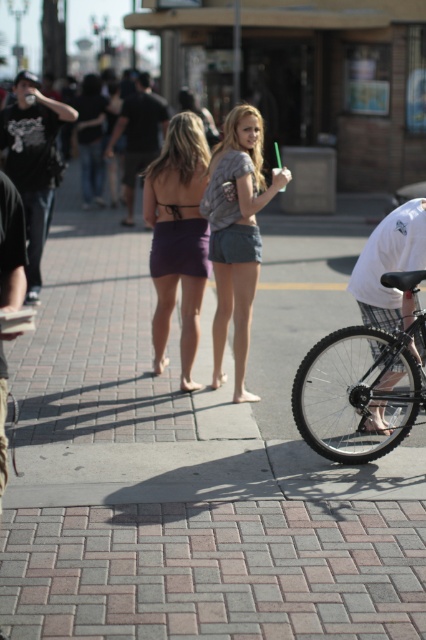
Question: Does black matte bicycle at lower right have a greater width compared to matte black t-shirt at left?

Choices:
 (A) no
 (B) yes

Answer: (A)

Question: Which point is closer to the camera?

Choices:
 (A) black cotton t-shirt at upper center
 (B) white mesh shorts at right
 (C) black matte bicycle at lower right
 (D) denim shorts at center

Answer: (C)

Question: Does denim shorts at center appear on the right side of black cotton t-shirt at upper center?

Choices:
 (A) no
 (B) yes

Answer: (B)

Question: Does black matte bicycle at lower right have a smaller size compared to black cotton t-shirt at upper center?

Choices:
 (A) yes
 (B) no

Answer: (A)

Question: Which point is closer to the camera?

Choices:
 (A) white mesh shorts at right
 (B) black leather jacket at left

Answer: (B)

Question: Which of the following is the closest to the observer?

Choices:
 (A) (40, 124)
 (B) (249, 109)
 (C) (351, 401)

Answer: (C)